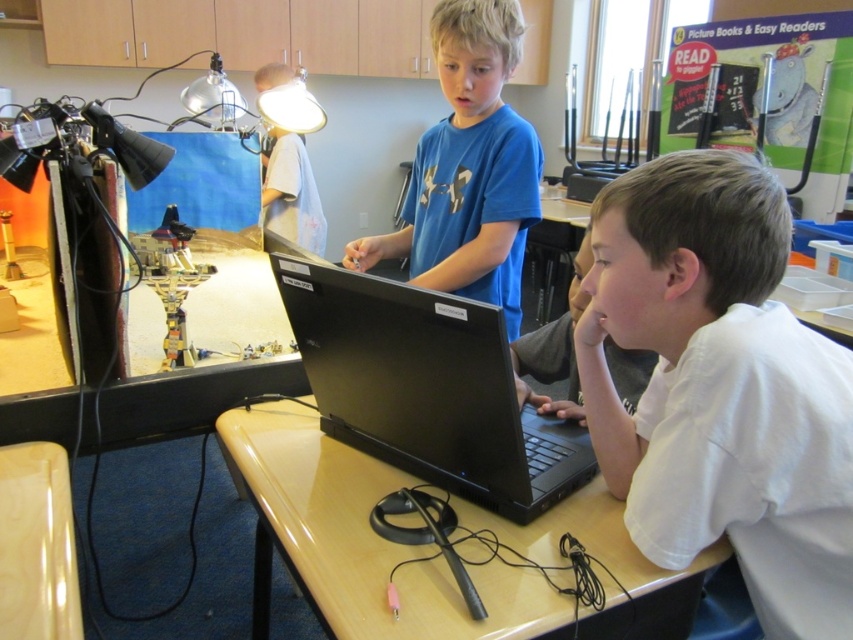
Question: Is glossy plastic table at center in front of blue matte shirt at center?

Choices:
 (A) yes
 (B) no

Answer: (A)

Question: Does glossy plastic table at center have a larger size compared to black matte laptop at center?

Choices:
 (A) no
 (B) yes

Answer: (B)

Question: Considering the real-world distances, which object is closest to the white matte shirt at lower right?

Choices:
 (A) blue matte shirt at center
 (B) black matte laptop at center
 (C) glossy plastic table at center

Answer: (B)

Question: Which is farther from the glossy plastic table at center?

Choices:
 (A) black matte laptop at center
 (B) blue matte shirt at center
 (C) white matte shirt at lower right

Answer: (B)

Question: Estimate the real-world distances between objects in this image. Which object is farther from the black matte laptop at center?

Choices:
 (A) white matte shirt at lower right
 (B) glossy plastic table at center
 (C) blue matte shirt at center

Answer: (C)

Question: Can you confirm if white matte shirt at lower right is positioned to the left of glossy plastic table at center?

Choices:
 (A) yes
 (B) no

Answer: (B)